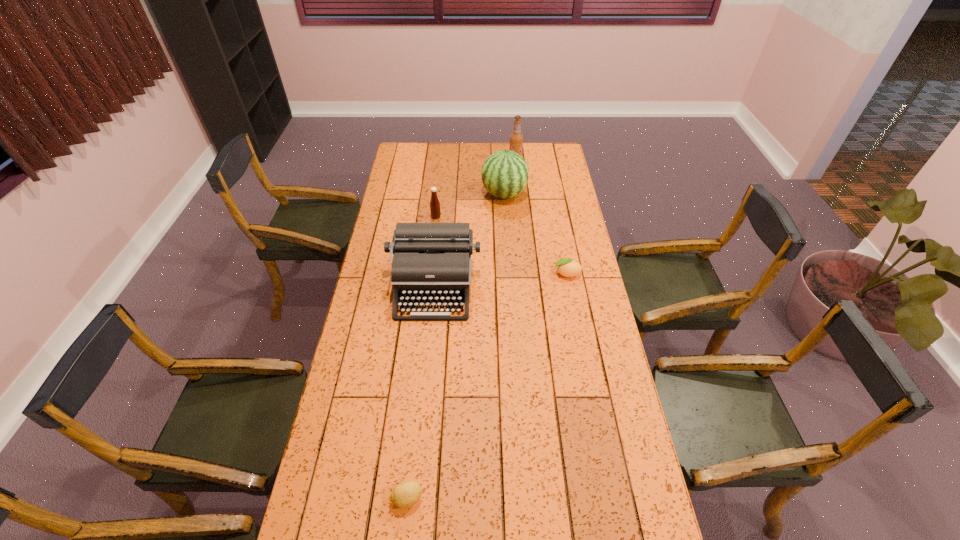
I want to click on free space located 0.210m on the front label of the farthest object, so click(468, 160).

Locate an element on the screen. free space located on the front label of the farthest object is located at coordinates (447, 160).

The height and width of the screenshot is (540, 960). What are the coordinates of `free spot located 0.070m on the left of the fifth nearest object` in the screenshot? It's located at (467, 194).

The image size is (960, 540). In order to click on vacant point located on the typing side of the fourth shortest object in this screenshot , I will do `click(429, 335)`.

Where is `vacant space situated on the back of the third shortest object`? Image resolution: width=960 pixels, height=540 pixels. vacant space situated on the back of the third shortest object is located at coordinates (437, 207).

Where is `vacant space located 0.110m with leaves positioned above the rightmost object`? This screenshot has width=960, height=540. vacant space located 0.110m with leaves positioned above the rightmost object is located at coordinates (524, 274).

In order to click on vacant region located with leaves positioned above the rightmost object in this screenshot , I will do `click(489, 274)`.

The width and height of the screenshot is (960, 540). What are the coordinates of `free space located 0.050m with leaves positioned above the rightmost object` in the screenshot? It's located at (540, 274).

The width and height of the screenshot is (960, 540). I want to click on free spot located at the stem end of the nearest object, so click(x=442, y=498).

Identify the location of object located at the far edge. The height and width of the screenshot is (540, 960). (516, 138).